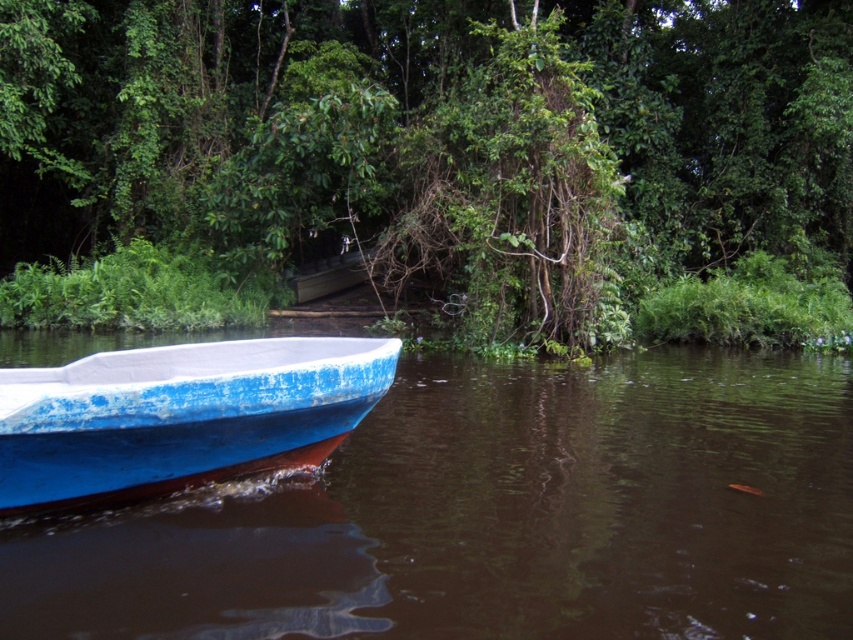
Question: Which point is farther from the camera taking this photo?

Choices:
 (A) (608, 570)
 (B) (801, 218)

Answer: (B)

Question: Which point is farther from the camera taking this photo?

Choices:
 (A) (305, 419)
 (B) (196, 0)
 (C) (461, 356)

Answer: (B)

Question: In this image, where is green leafy tree at center located relative to blue painted wood boat at lower left?

Choices:
 (A) left
 (B) right

Answer: (A)

Question: Which is nearer to the blue painted wood boat at lower left?

Choices:
 (A) green leafy tree at center
 (B) blue matte boat at lower left

Answer: (B)

Question: Does blue painted wood boat at lower left have a lesser width compared to blue matte boat at lower left?

Choices:
 (A) no
 (B) yes

Answer: (A)

Question: Is blue painted wood boat at lower left to the left of blue matte boat at lower left from the viewer's perspective?

Choices:
 (A) no
 (B) yes

Answer: (A)